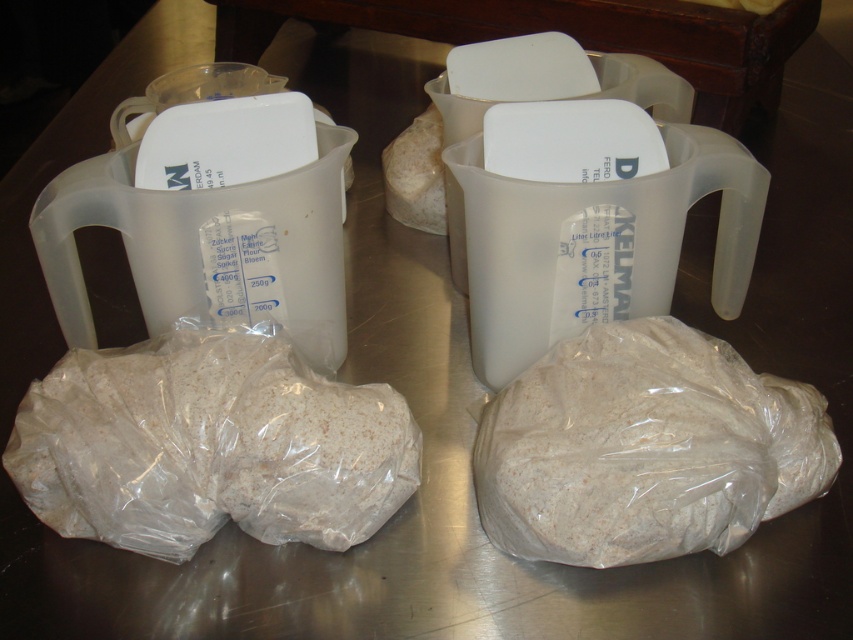
Consider the image. You are a baker preparing dough and need to choose a container to store your dough. You have a translucent plastic bag at lower right and a transparent plastic jug at center. Which container is more suitable for storing dough based on their thickness?

The transparent plastic jug at center is more suitable for storing dough because it is thicker than the translucent plastic bag at lower right, providing better protection and durability.

You are preparing to bake bread and need to store the dough. You have a translucent plastic bag at lower right and a transparent plastic jug at center. Which container is positioned to the right of the other?

The translucent plastic bag at lower right is positioned to the right of the transparent plastic jug at center.

You are a baker preparing to store dough balls. You have a translucent plastic bag at lower right and a transparent plastic jug at upper center. Which container can hold more dough?

The transparent plastic jug at upper center can hold more dough because it occupies more space than the translucent plastic bag at lower right.